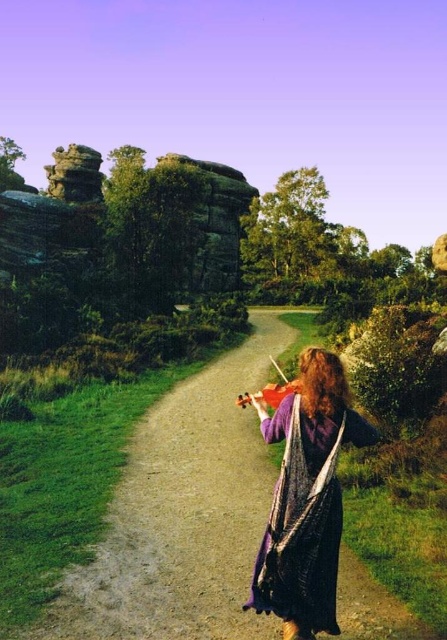
Can you confirm if purple fabric at center is wider than rustic stone rock formation at upper left?

In fact, purple fabric at center might be narrower than rustic stone rock formation at upper left.

Is purple fabric at center to the left of rustic stone rock formation at upper left from the viewer's perspective?

In fact, purple fabric at center is to the right of rustic stone rock formation at upper left.

Locate an element on the screen. This screenshot has width=447, height=640. purple fabric at center is located at coordinates (307, 499).

Does purple fabric at center appear under wooden violin at center?

Indeed, purple fabric at center is positioned under wooden violin at center.

Describe the element at coordinates (307, 499) in the screenshot. The image size is (447, 640). I see `purple fabric at center` at that location.

Measure the distance between purple fabric at center and camera.

5.09 meters

Locate an element on the screen. The width and height of the screenshot is (447, 640). purple fabric at center is located at coordinates (307, 499).

Consider the image. Is dirt path at center below rustic stone rock formation at upper left?

Indeed, dirt path at center is positioned under rustic stone rock formation at upper left.

How distant is dirt path at center from rustic stone rock formation at upper left?

A distance of 250.37 feet exists between dirt path at center and rustic stone rock formation at upper left.

Describe the element at coordinates (182, 515) in the screenshot. I see `dirt path at center` at that location.

Identify the location of dirt path at center. pyautogui.click(x=182, y=515).